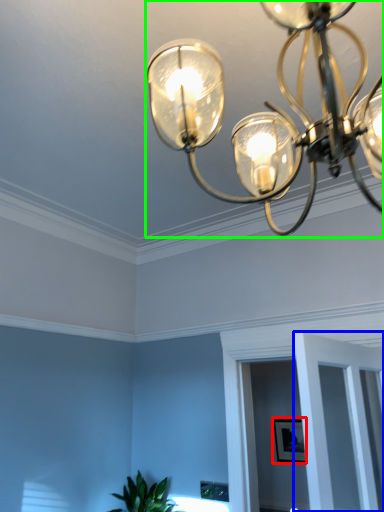
Question: Estimate the real-world distances between objects in this image. Which object is closer to picture frame (highlighted by a red box), glass door (highlighted by a blue box) or lamp (highlighted by a green box)?

Choices:
 (A) glass door
 (B) lamp

Answer: (A)